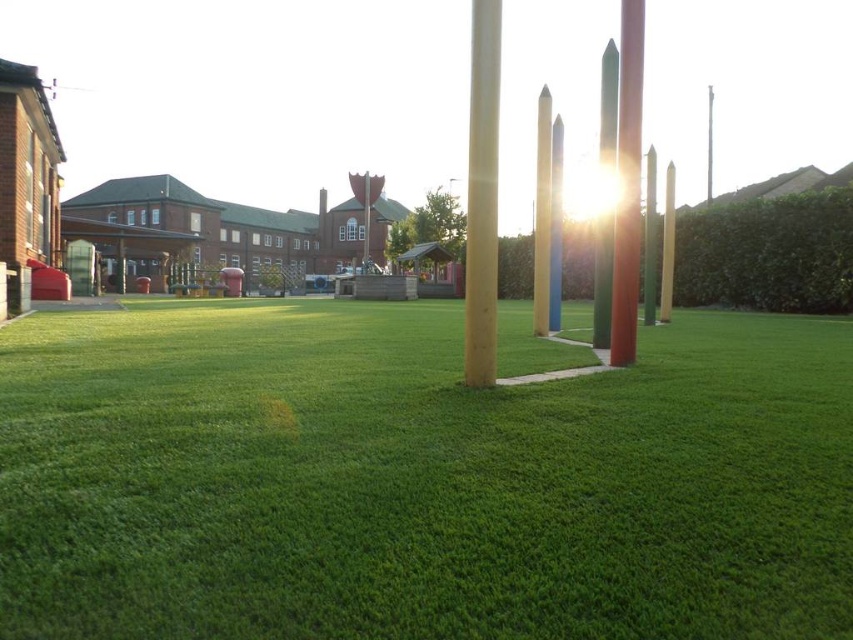
Question: Which object is farther from the camera taking this photo?

Choices:
 (A) matte wood pole at center
 (B) green polished wooden pole at center
 (C) shiny metallic pole at center
 (D) smooth red pole at center

Answer: (D)

Question: Estimate the real-world distances between objects in this image. Which object is farther from the smooth red pole at center?

Choices:
 (A) green polished pole at center
 (B) shiny metallic pole at center
 (C) green artificial turf at center
 (D) green polished wooden pole at center

Answer: (C)

Question: Among these points, which one is nearest to the camera?

Choices:
 (A) (630, 22)
 (B) (645, 177)
 (C) (474, 61)
 (D) (201, 552)

Answer: (D)

Question: Does green artificial turf at center have a smaller size compared to smooth red pole at center?

Choices:
 (A) yes
 (B) no

Answer: (B)

Question: Is shiny metallic pole at center further to the viewer compared to green polished stone pillar at center?

Choices:
 (A) yes
 (B) no

Answer: (B)

Question: Is green polished stone pillar at center to the left of smooth red pole at center from the viewer's perspective?

Choices:
 (A) yes
 (B) no

Answer: (A)